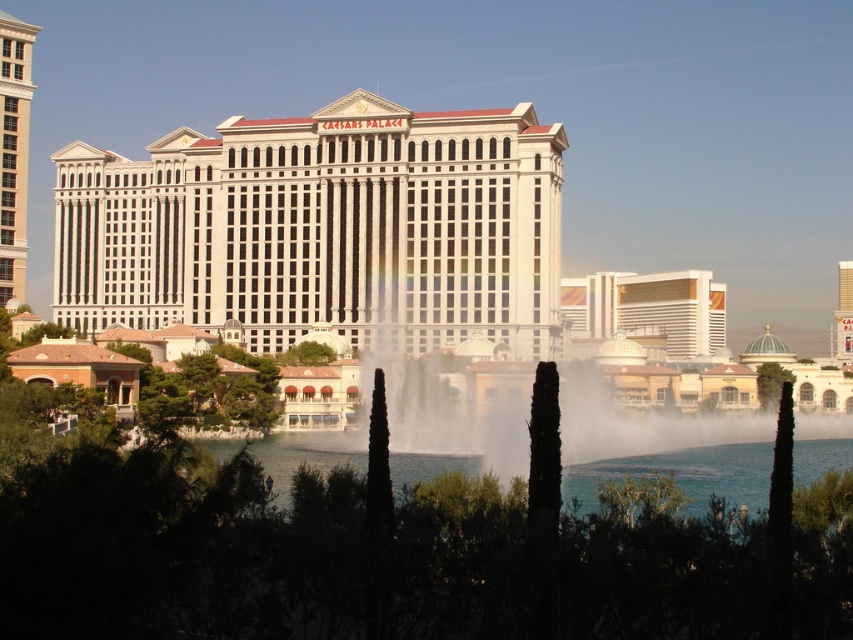
You are standing in front of the Caesars Palace and want to cross to the other side. There is a clear water at center and a white glossy building at left. Which path would allow you to cross without getting wet?

The white glossy building at left is narrower than the clear water at center, so crossing next to the white glossy building at left would keep you drier since it has less water coverage.